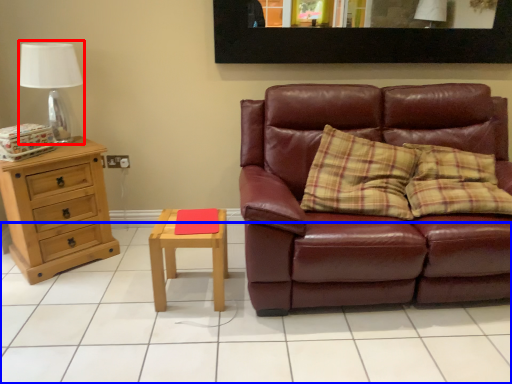
Question: Which object appears farthest to the camera in this image, table lamp (highlighted by a red box) or tile (highlighted by a blue box)?

Choices:
 (A) table lamp
 (B) tile

Answer: (A)